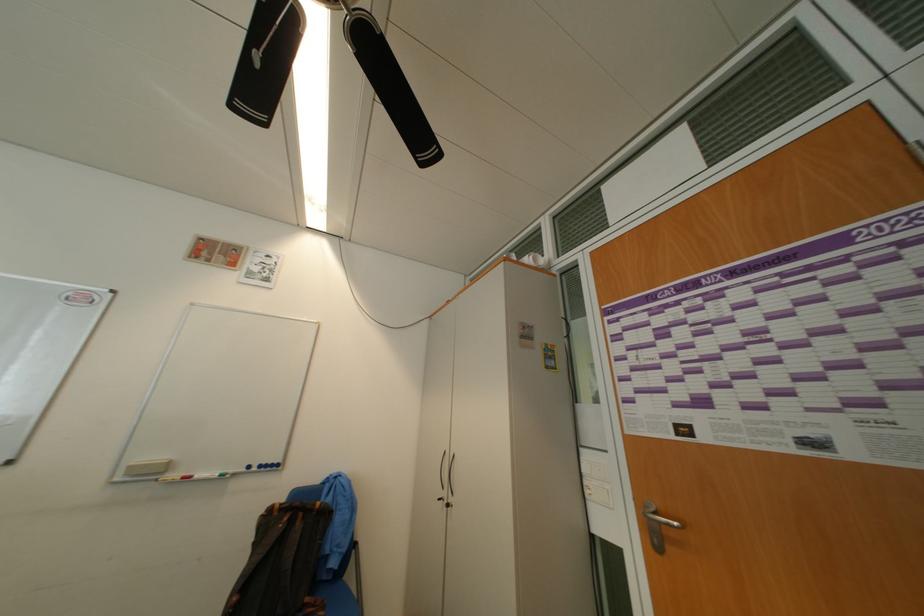
Where is `white paper cup`? The width and height of the screenshot is (924, 616). white paper cup is located at coordinates (535, 259).